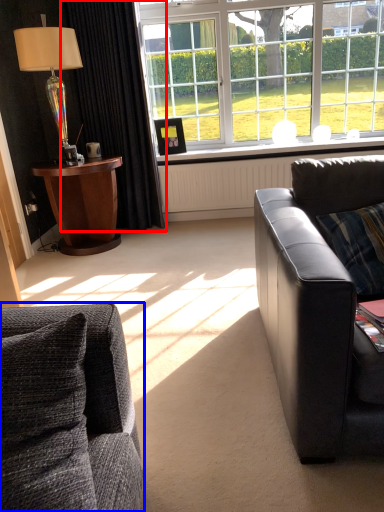
Question: Among these objects, which one is farthest to the camera, curtain (highlighted by a red box) or studio couch (highlighted by a blue box)?

Choices:
 (A) curtain
 (B) studio couch

Answer: (A)